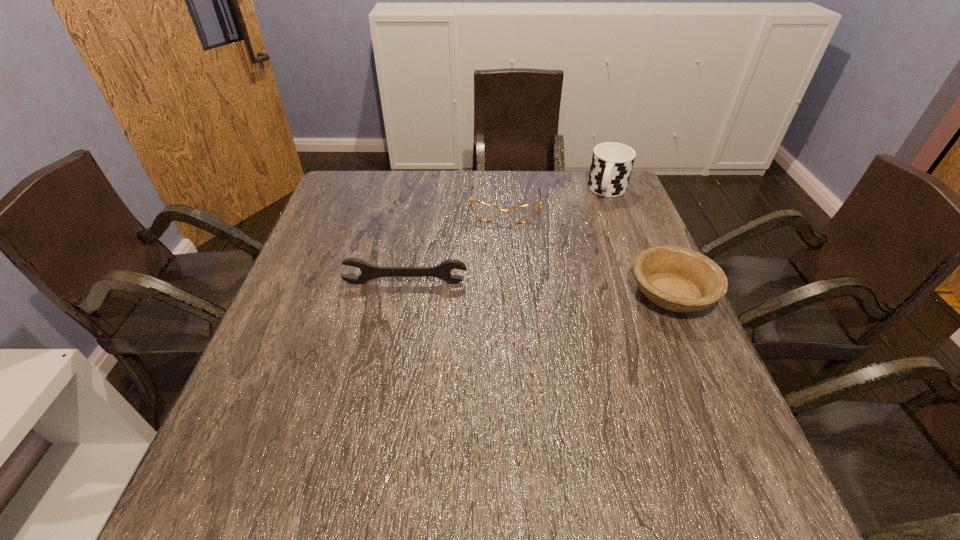
I want to click on vacant spot on the desktop that is between the wrench and the bowl and is positioned on the front-facing side of the spectacles, so click(499, 286).

This screenshot has height=540, width=960. In order to click on free space on the desktop that is between the wrench and the bowl and is positioned on the side of the tallest object with the handle in this screenshot , I will do `click(571, 289)`.